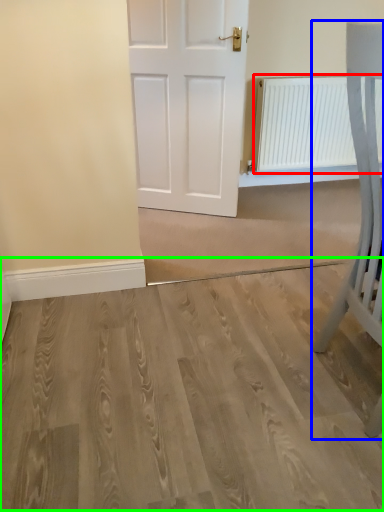
Question: Based on their relative distances, which object is nearer to radiator (highlighted by a red box)? Choose from furniture (highlighted by a blue box) and plain (highlighted by a green box).

Choices:
 (A) furniture
 (B) plain

Answer: (A)